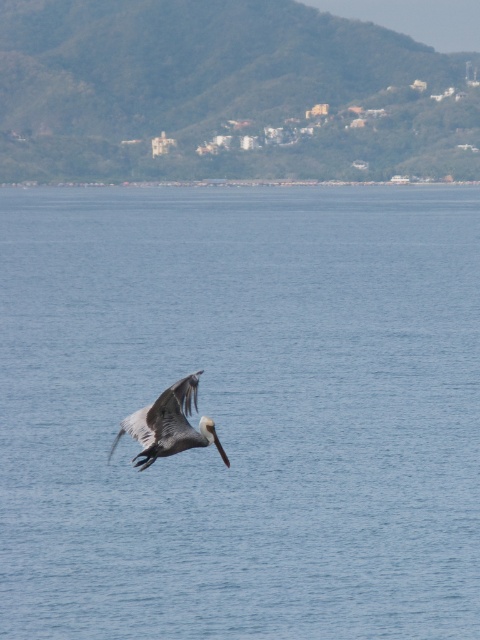
Question: Does blue water at center appear on the right side of brown feathered pelican at center?

Choices:
 (A) yes
 (B) no

Answer: (A)

Question: Which point is farther to the camera?

Choices:
 (A) blue water at center
 (B) brown feathered pelican at center

Answer: (A)

Question: Is blue water at center thinner than brown feathered pelican at center?

Choices:
 (A) yes
 (B) no

Answer: (B)

Question: Does blue water at center appear over brown feathered pelican at center?

Choices:
 (A) yes
 (B) no

Answer: (A)

Question: Which point appears closest to the camera in this image?

Choices:
 (A) (144, 442)
 (B) (26, 307)

Answer: (A)